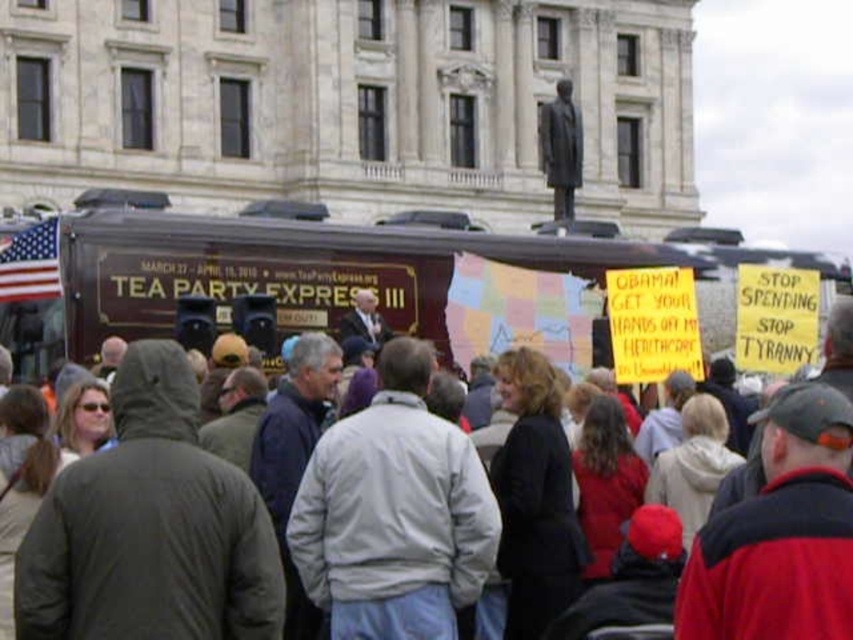
Question: Estimate the real-world distances between objects in this image. Which object is farther from the gray wool jacket at center?

Choices:
 (A) maroon polished wood tour bus at center
 (B) gray fabric jacket at center

Answer: (A)

Question: In this image, where is maroon polished wood tour bus at center located relative to gray fabric jacket at center?

Choices:
 (A) below
 (B) above

Answer: (B)

Question: Can you confirm if maroon polished wood tour bus at center is bigger than gray wool jacket at center?

Choices:
 (A) no
 (B) yes

Answer: (A)

Question: Which of the following is the closest to the observer?

Choices:
 (A) gray fabric jacket at center
 (B) maroon polished wood tour bus at center

Answer: (A)

Question: Does maroon polished wood tour bus at center appear on the left side of gray fabric jacket at center?

Choices:
 (A) no
 (B) yes

Answer: (A)

Question: Which point is closer to the camera taking this photo?

Choices:
 (A) (404, 598)
 (B) (503, 486)
 (C) (396, 296)

Answer: (A)